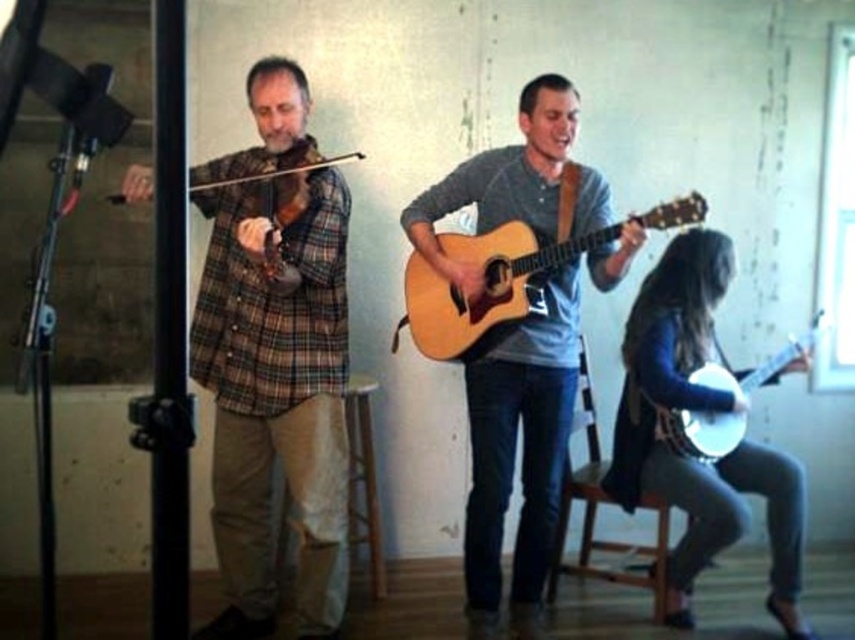
Based on the photo, you are a photographer setting up for a group photo of the musicians. You want to position yourself so that you can capture both the wooden stool at lower center and the brown wood stool at center in the same frame. Based on their positions, which stool should you place your camera closer to in order to ensure both are visible without moving the stools?

Since the wooden stool at lower center is to the right of the brown wood stool at center, you should position your camera closer to the brown wood stool at center. This way, the camera can capture both stools in the frame as the wooden stool at lower center is already positioned to the right of the brown one, allowing for a wider shot that includes both without needing to move them.

You are a photographer setting up a tripod to capture the musicians. The matte brown guitar at center and the white glossy banjo at lower right are both in your frame. Since you want to focus on the smaller instrument, which one should you aim your camera at?

The white glossy banjo at lower right is smaller than the matte brown guitar at center, so you should aim your camera at the white glossy banjo at lower right to focus on the smaller instrument.